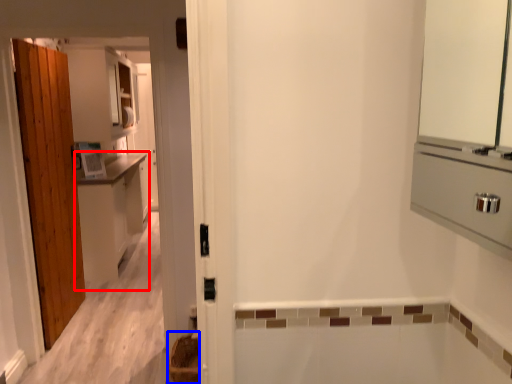
Question: Which point is closer to the camera, cabinetry (highlighted by a red box) or basket (highlighted by a blue box)?

Choices:
 (A) cabinetry
 (B) basket

Answer: (B)